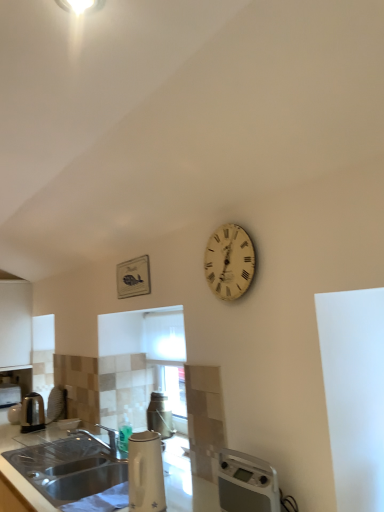
Question: Is white wooden clock at upper right aimed at white glossy electric kettle at lower center?

Choices:
 (A) no
 (B) yes

Answer: (A)

Question: Considering the relative sizes of white wooden clock at upper right and white glossy electric kettle at lower center in the image provided, is white wooden clock at upper right smaller than white glossy electric kettle at lower center?

Choices:
 (A) yes
 (B) no

Answer: (A)

Question: Would you say white wooden clock at upper right contains white glossy electric kettle at lower center?

Choices:
 (A) no
 (B) yes

Answer: (A)

Question: Is white wooden clock at upper right bigger than white glossy electric kettle at lower center?

Choices:
 (A) yes
 (B) no

Answer: (B)

Question: Is white wooden clock at upper right positioned behind white glossy electric kettle at lower center?

Choices:
 (A) no
 (B) yes

Answer: (B)

Question: Is white wooden clock at upper right at the right side of white glossy electric kettle at lower center?

Choices:
 (A) no
 (B) yes

Answer: (B)

Question: Is white glossy electric kettle at lower center turned away from polished stainless steel kettle at left?

Choices:
 (A) no
 (B) yes

Answer: (A)

Question: From a real-world perspective, is white glossy electric kettle at lower center under polished stainless steel kettle at left?

Choices:
 (A) yes
 (B) no

Answer: (B)

Question: Is white glossy electric kettle at lower center smaller than polished stainless steel kettle at left?

Choices:
 (A) no
 (B) yes

Answer: (A)

Question: Is white glossy electric kettle at lower center shorter than polished stainless steel kettle at left?

Choices:
 (A) yes
 (B) no

Answer: (B)

Question: Is white glossy electric kettle at lower center touching polished stainless steel kettle at left?

Choices:
 (A) yes
 (B) no

Answer: (B)

Question: Is white glossy electric kettle at lower center further to camera compared to polished stainless steel kettle at left?

Choices:
 (A) no
 (B) yes

Answer: (A)

Question: Does white matte cabinet at left have a greater width compared to white wooden clock at upper right?

Choices:
 (A) no
 (B) yes

Answer: (B)